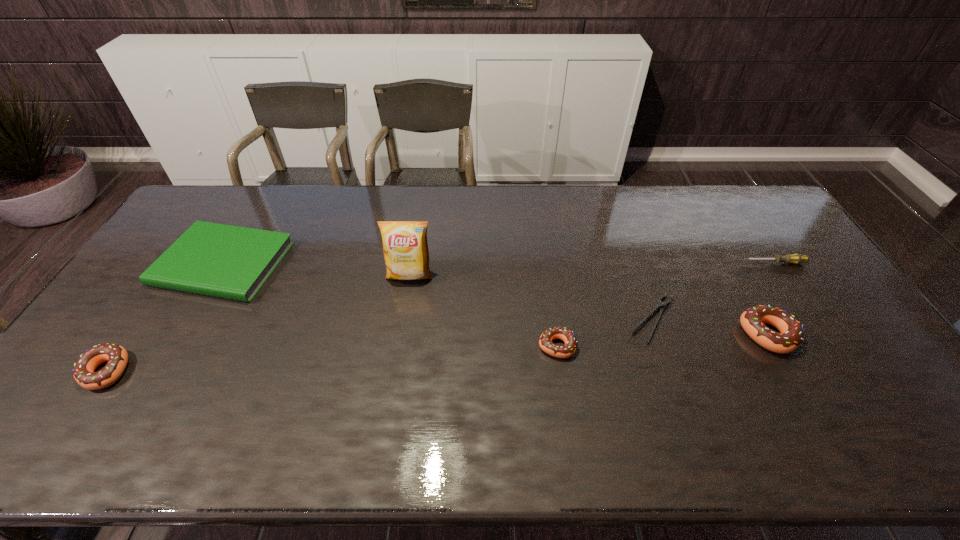
Locate an element on the screen. The image size is (960, 540). the leftmost doughnut is located at coordinates pyautogui.click(x=83, y=371).

Identify the location of the third tallest object. (83, 371).

Where is `the fourth object from left to right`? the fourth object from left to right is located at coordinates (569, 349).

Find the location of a particular element. This screenshot has height=540, width=960. the second doughnut from right to left is located at coordinates (569, 349).

Where is `the second tallest object`? The image size is (960, 540). the second tallest object is located at coordinates (752, 320).

Where is `the tallest doughnut`? the tallest doughnut is located at coordinates (752, 320).

Image resolution: width=960 pixels, height=540 pixels. I want to click on screwdriver, so click(796, 258).

Where is `paperback book`? Image resolution: width=960 pixels, height=540 pixels. paperback book is located at coordinates (231, 262).

Locate an element on the screen. the third object from right to left is located at coordinates (661, 305).

Locate an element on the screen. This screenshot has height=540, width=960. tongs is located at coordinates (661, 305).